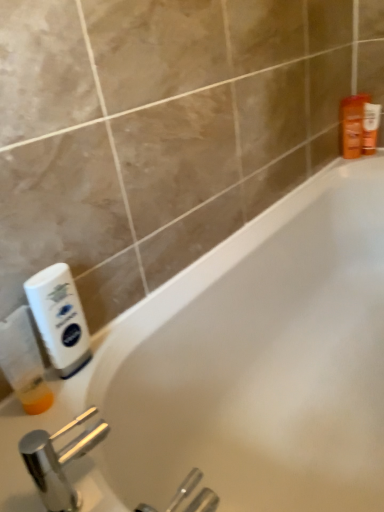
You are a GUI agent. You are given a task and a screenshot of the screen. Output one action in this format:
    pyautogui.click(x=<x>, y=<y>)
    Task: Click on the vacant area that is in front of white plastic bottle at left, the 1th cleaning product in the right-to-left sequence
    The width and height of the screenshot is (384, 512).
    Given the screenshot: What is the action you would take?
    pyautogui.click(x=56, y=435)